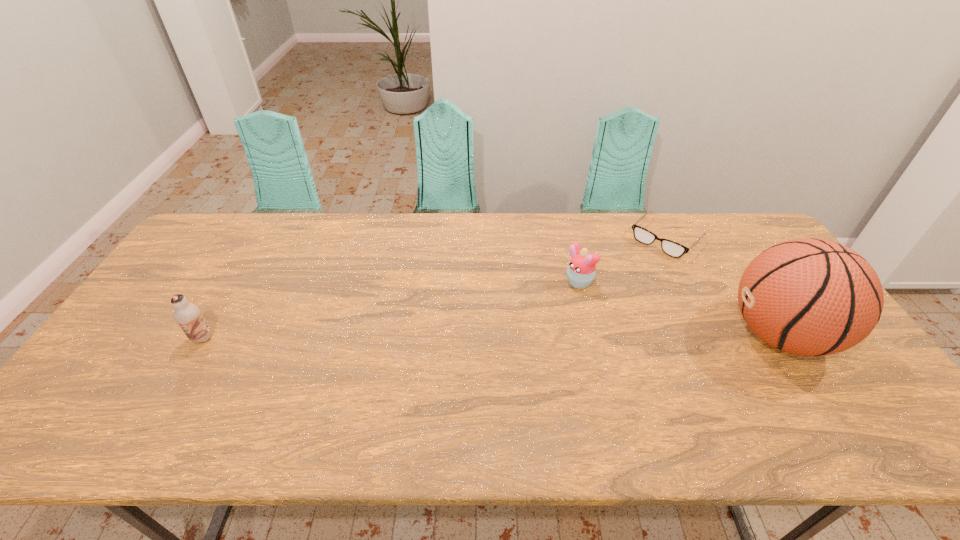
You are a GUI agent. You are given a task and a screenshot of the screen. Output one action in this format:
    pyautogui.click(x=<x>, y=<y>)
    Task: Click on the vacant space that satisfies the following two spatial constraints: 1. on the front side of the basketball; 2. on the side where the inflation valve is located
    The height and width of the screenshot is (540, 960).
    Given the screenshot: What is the action you would take?
    pyautogui.click(x=589, y=335)

Identify the location of blank space that satisfies the following two spatial constraints: 1. on the front side of the tallest object; 2. on the side where the inflation valve is located. The image size is (960, 540). (714, 335).